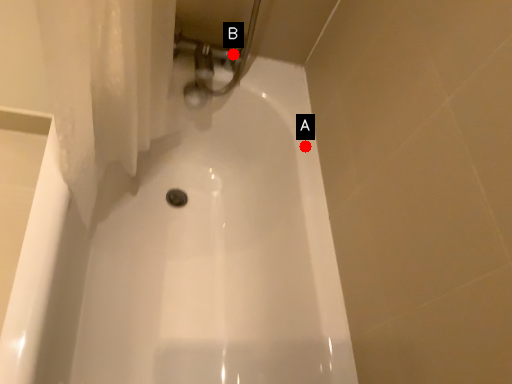
Question: Two points are circled on the image, labeled by A and B beside each circle. Which point appears farthest from the camera in this image?

Choices:
 (A) A is further
 (B) B is further

Answer: (B)